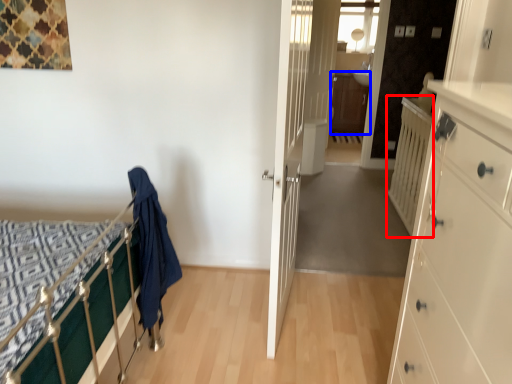
Question: Which object is closer to the camera taking this photo, balustrade (highlighted by a red box) or file cabinet (highlighted by a blue box)?

Choices:
 (A) balustrade
 (B) file cabinet

Answer: (A)